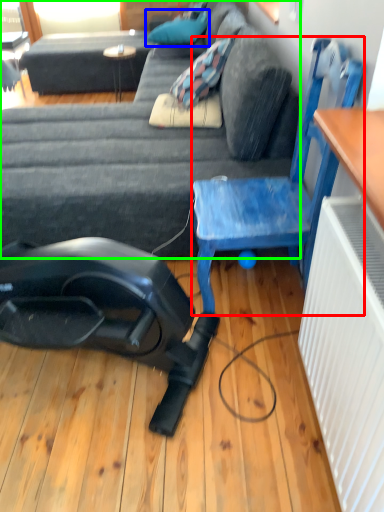
Question: Which object is the farthest from chair (highlighted by a red box)? Choose among these: pillow (highlighted by a blue box) or studio couch (highlighted by a green box).

Choices:
 (A) pillow
 (B) studio couch

Answer: (A)